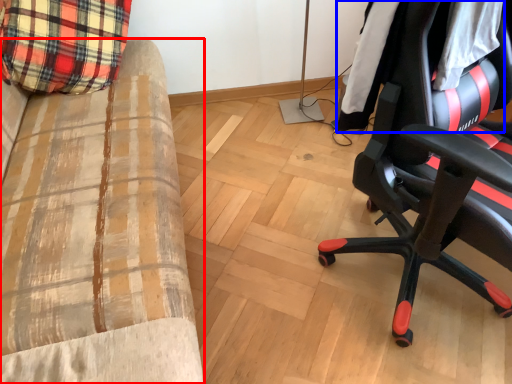
Question: Which of the following is the closest to the observer, furniture (highlighted by a red box) or clothing (highlighted by a blue box)?

Choices:
 (A) furniture
 (B) clothing

Answer: (A)